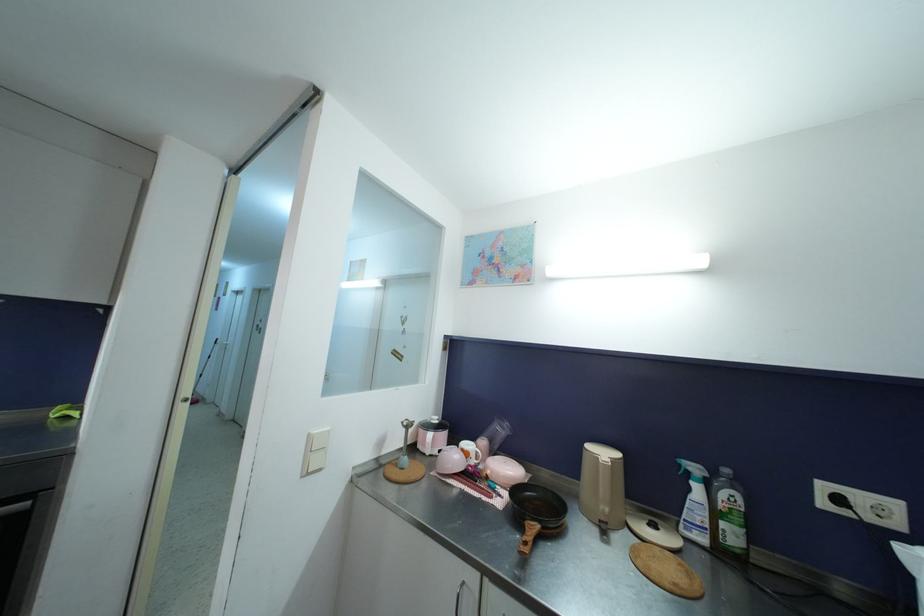
The height and width of the screenshot is (616, 924). Describe the element at coordinates (528, 537) in the screenshot. I see `the wooden pan handle` at that location.